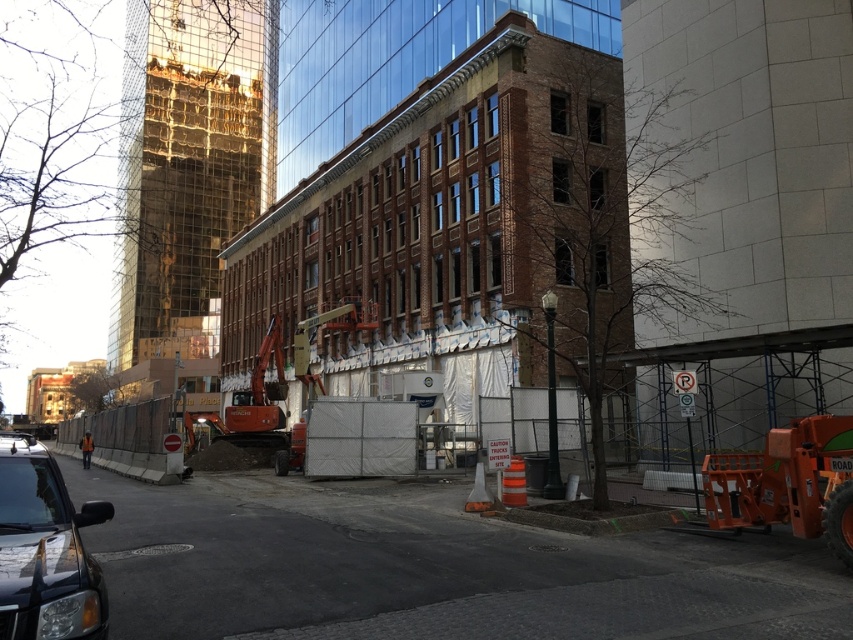
Question: Which object is closer to the camera taking this photo?

Choices:
 (A) shiny black suv at lower left
 (B) orange reflective vest at lower left

Answer: (A)

Question: Can you confirm if shiny black suv at lower left is positioned to the left of orange reflective vest at lower left?

Choices:
 (A) no
 (B) yes

Answer: (A)

Question: Is shiny black suv at lower left thinner than orange reflective vest at lower left?

Choices:
 (A) no
 (B) yes

Answer: (B)

Question: Among these points, which one is nearest to the camera?

Choices:
 (A) (65, 500)
 (B) (90, 435)

Answer: (A)

Question: Can you confirm if shiny black suv at lower left is positioned above orange reflective vest at lower left?

Choices:
 (A) yes
 (B) no

Answer: (A)